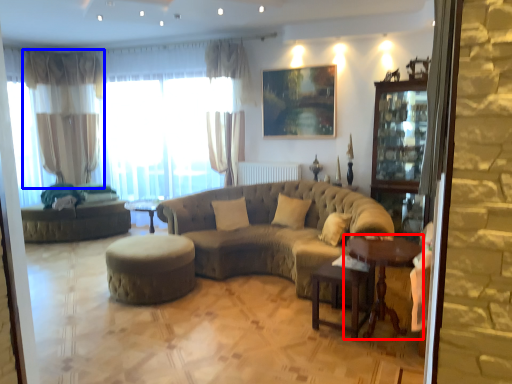
Question: Which object appears closest to the camera in this image, table (highlighted by a red box) or curtain (highlighted by a blue box)?

Choices:
 (A) table
 (B) curtain

Answer: (A)